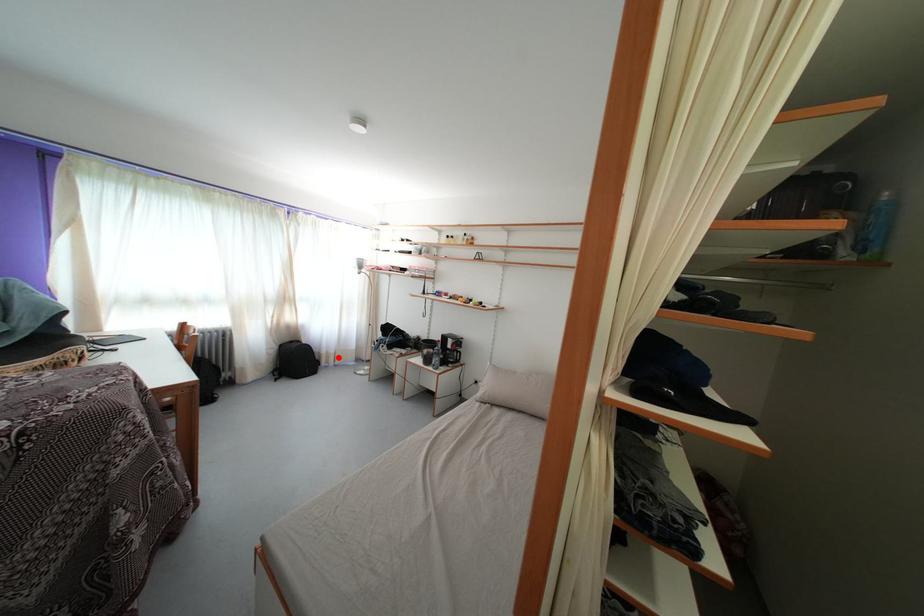
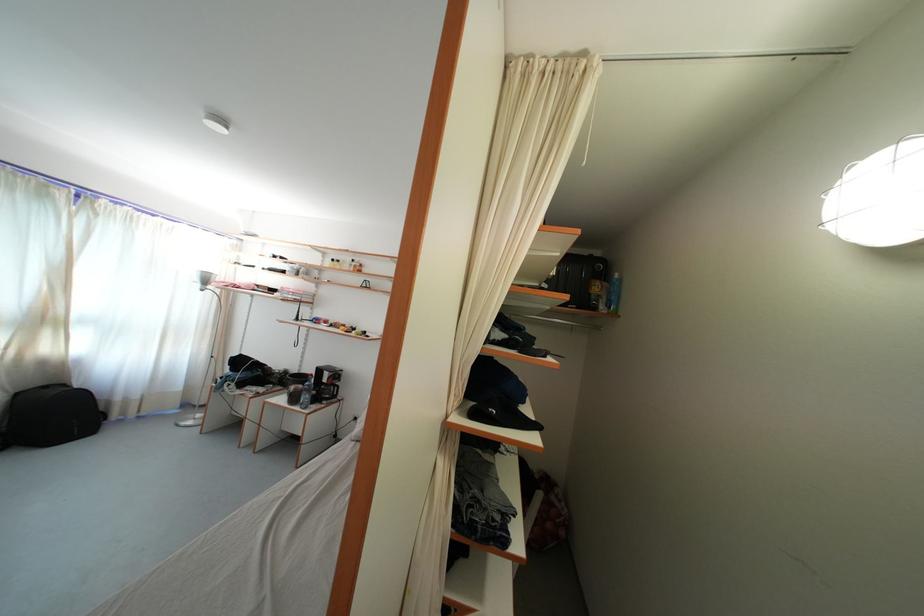
Locate, in the second image, the point that corresponds to the highlighted location in the first image.

(141, 403)